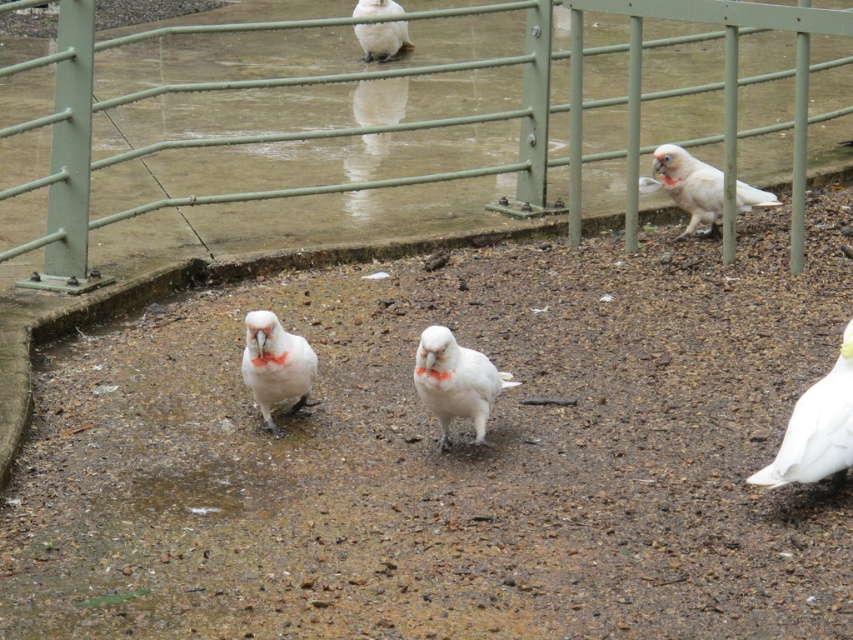
Question: Which point appears farthest from the camera in this image?

Choices:
 (A) (706, 218)
 (B) (798, 132)
 (C) (375, 26)
 (D) (258, 387)

Answer: (C)

Question: Is white matte parrot at center in front of white feathered parrot at upper right?

Choices:
 (A) yes
 (B) no

Answer: (A)

Question: Which point is farther from the camera taking this photo?

Choices:
 (A) (683, 202)
 (B) (376, 36)
 (C) (815, 401)

Answer: (B)

Question: Which object is farther from the camera taking this photo?

Choices:
 (A) white feathered parrot at upper right
 (B) white feathered parrot at center
 (C) green metal fence at upper center

Answer: (A)

Question: Can you confirm if white feathered parrot at lower right is positioned below white feathered parrot at upper right?

Choices:
 (A) no
 (B) yes

Answer: (B)

Question: Is white feathered parrot at lower right to the left of white feathered bird at upper center from the viewer's perspective?

Choices:
 (A) no
 (B) yes

Answer: (A)